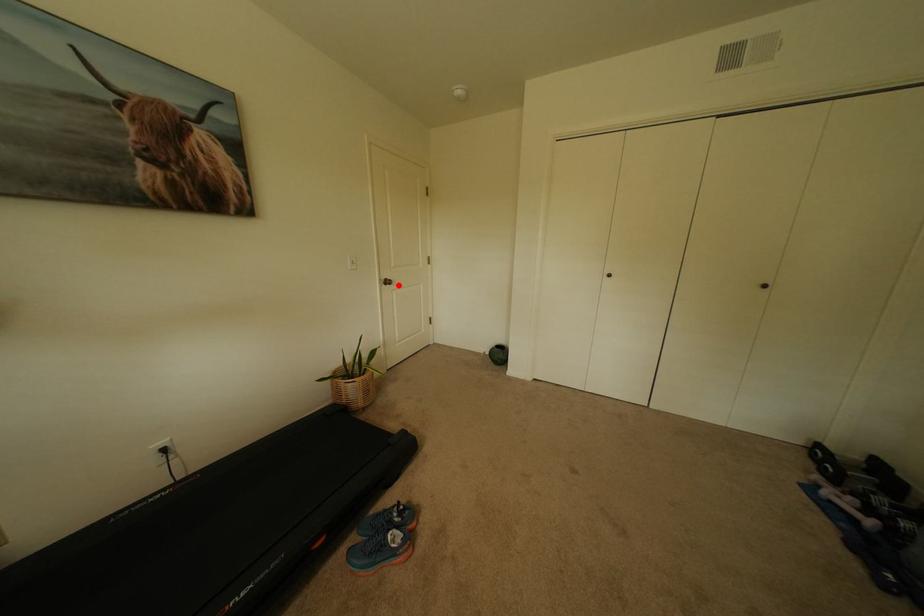
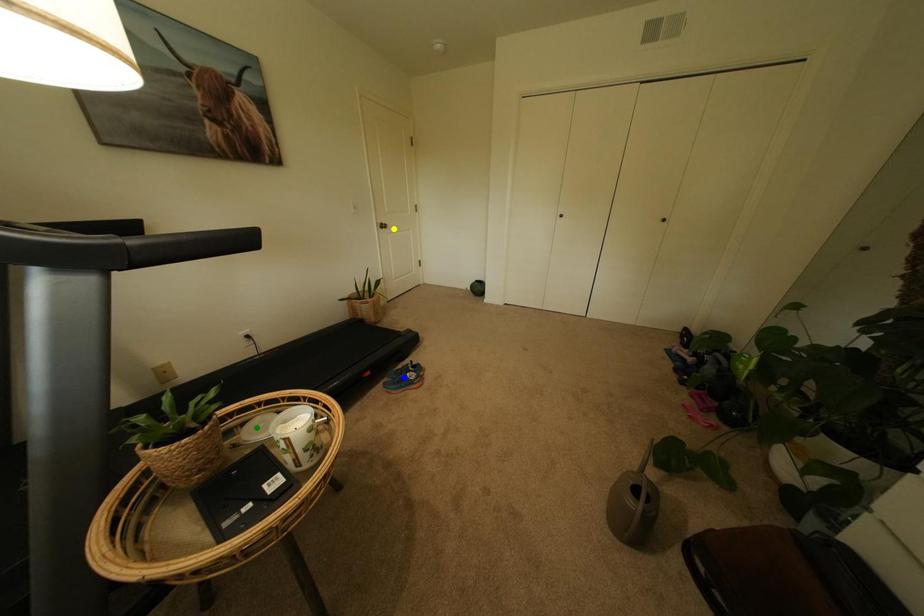
Question: I am providing you with two images of the same scene from different viewpoints. A red point is marked on the first image. You are given multiple points on the second image. Which point in image 2 is actually the same real-world point as the red point in image 1?

Choices:
 (A) green point
 (B) yellow point
 (C) blue point

Answer: (B)